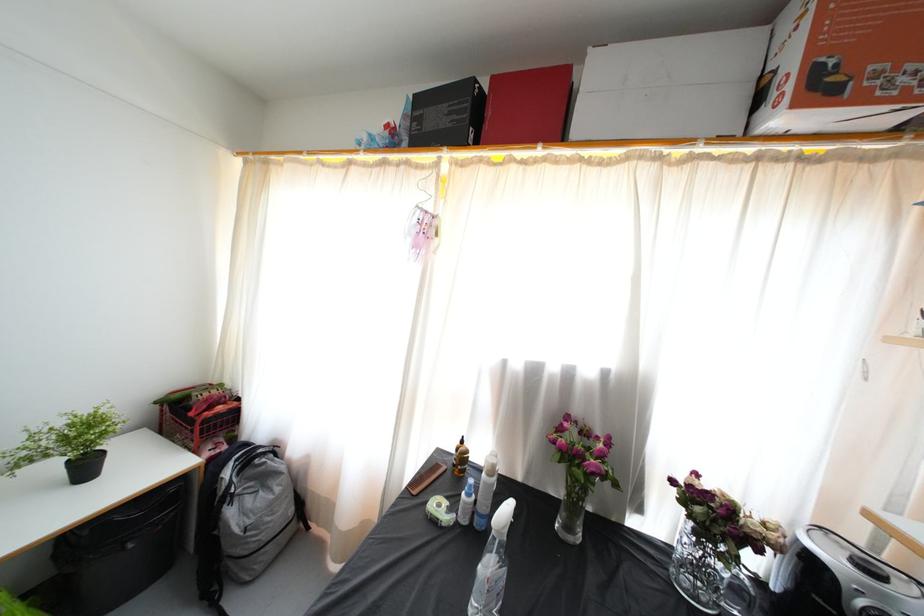
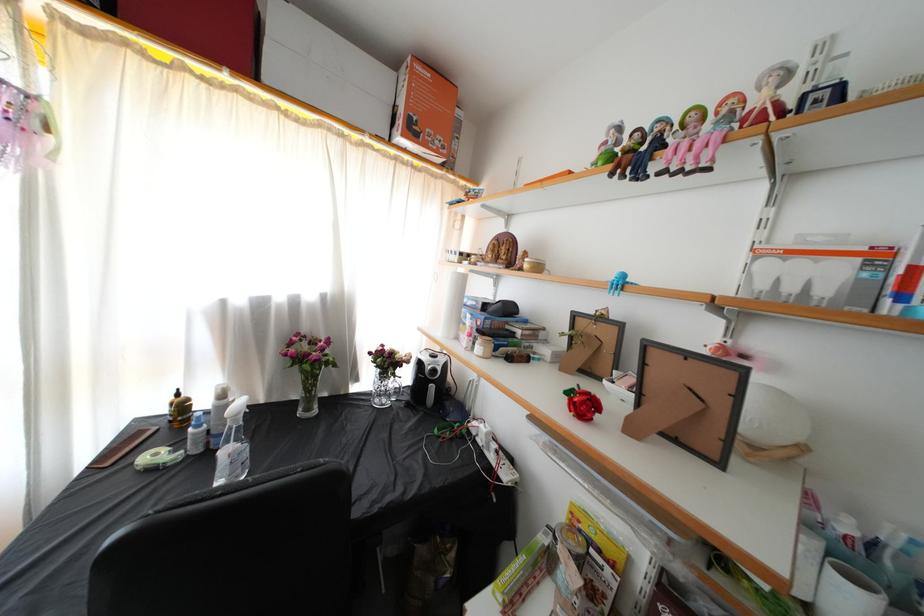
Where in the second image is the point corresponding to point (457, 456) from the first image?

(171, 416)